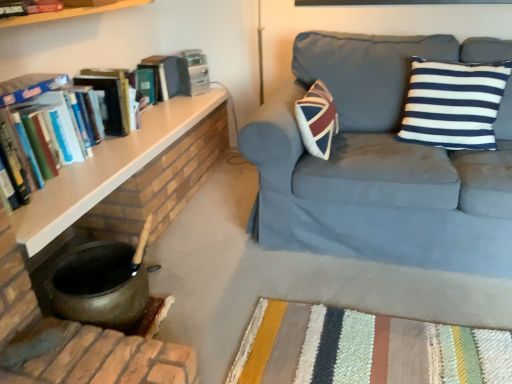
Where is `free space in front of hardcover book at upper left`? Image resolution: width=512 pixels, height=384 pixels. free space in front of hardcover book at upper left is located at coordinates (160, 112).